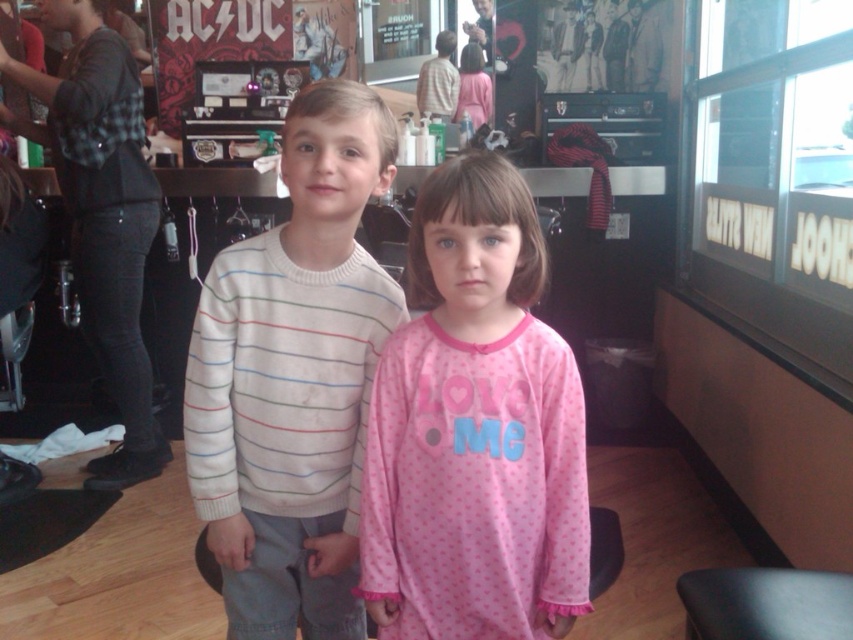
Can you confirm if pink fleece pajamas at center is thinner than white striped sweater at center?

Correct, pink fleece pajamas at center's width is less than white striped sweater at center's.

Is point (437, 371) closer to viewer compared to point (210, 449)?

Yes.

Is point (456, 381) positioned before point (222, 580)?

That is True.

Locate an element on the screen. The image size is (853, 640). pink fleece pajamas at center is located at coordinates (474, 429).

The image size is (853, 640). I want to click on white striped sweater at center, so click(x=294, y=378).

Who is more forward, [383,156] or [90,484]?

Point [383,156] is more forward.

Is point (345, 449) farther from viewer compared to point (105, 339)?

No, (345, 449) is in front of (105, 339).

Image resolution: width=853 pixels, height=640 pixels. Identify the location of white striped sweater at center. (294, 378).

Which is more to the right, pink fleece pajamas at center or black flannel shirt at left?

pink fleece pajamas at center is more to the right.

Between pink fleece pajamas at center and black flannel shirt at left, which one appears on the left side from the viewer's perspective?

Positioned to the left is black flannel shirt at left.

What do you see at coordinates (474, 429) in the screenshot?
I see `pink fleece pajamas at center` at bounding box center [474, 429].

The image size is (853, 640). Find the location of `pink fleece pajamas at center`. pink fleece pajamas at center is located at coordinates (474, 429).